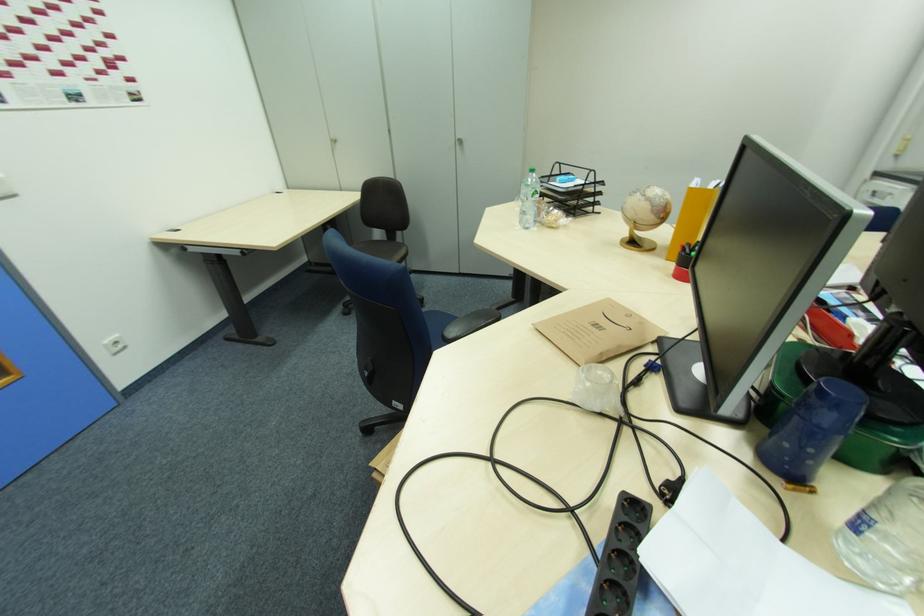
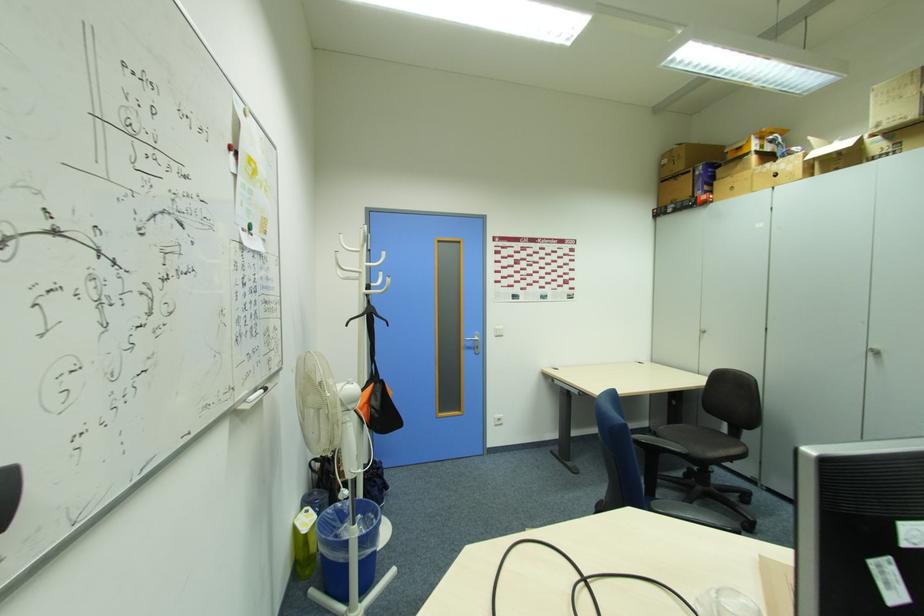
Question: How did the camera likely rotate?

Choices:
 (A) Left
 (B) Right
 (C) Up
 (D) Down

Answer: (A)